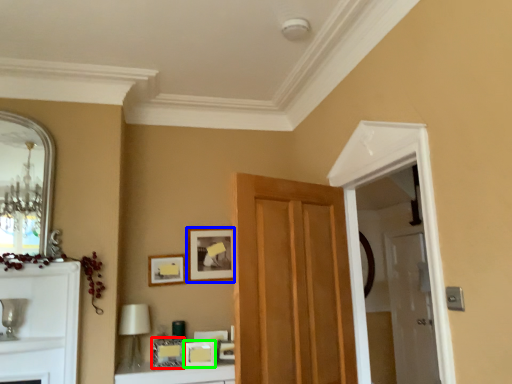
Question: Based on their relative distances, which object is nearer to picture frame (highlighted by a red box)? Choose from picture frame (highlighted by a blue box) and picture frame (highlighted by a green box).

Choices:
 (A) picture frame
 (B) picture frame

Answer: (B)